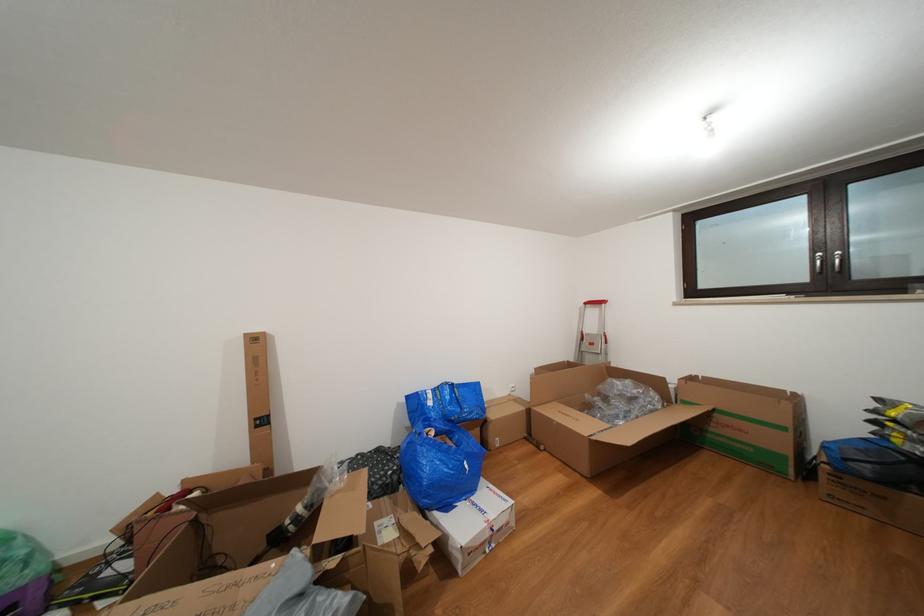
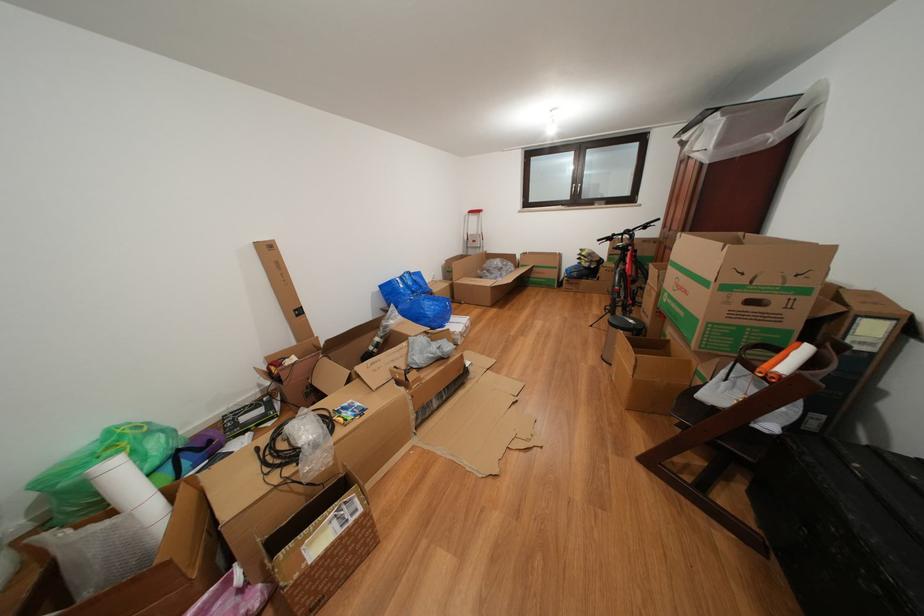
Find the pixel in the second image that matches point (672, 384) in the first image.

(523, 261)